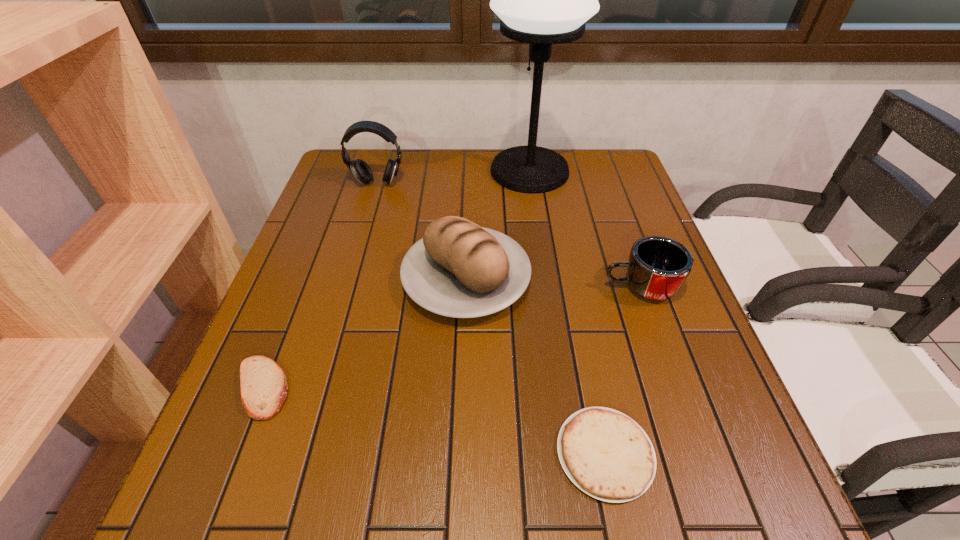
Identify the location of blank space located 0.370m on the side of the mug with the handle. This screenshot has height=540, width=960. (438, 288).

Find the location of `vacant area located on the side of the mug with the handle`. vacant area located on the side of the mug with the handle is located at coordinates (438, 288).

I want to click on vacant area located on the right of the pita bread, so click(x=350, y=388).

What are the coordinates of `vacant space located 0.100m on the left of the tortilla` in the screenshot? It's located at [x=496, y=453].

You are a GUI agent. You are given a task and a screenshot of the screen. Output one action in this format:
    pyautogui.click(x=<x>, y=<y>)
    Task: Click on the table lamp located in the far edge section of the desktop
    Image resolution: width=960 pixels, height=540 pixels.
    Given the screenshot: What is the action you would take?
    pyautogui.click(x=542, y=0)

Where is `earphone located at the far edge`? Image resolution: width=960 pixels, height=540 pixels. earphone located at the far edge is located at coordinates (361, 170).

What are the coordinates of `object situated at the near edge` in the screenshot? It's located at (606, 454).

Where is `earphone situated at the left edge`? The width and height of the screenshot is (960, 540). earphone situated at the left edge is located at coordinates (361, 170).

I want to click on pita bread present at the left edge, so click(263, 384).

Where is `object that is at the right edge`? object that is at the right edge is located at coordinates (658, 266).